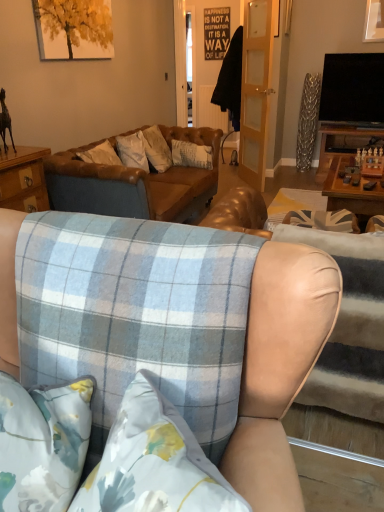
The width and height of the screenshot is (384, 512). What do you see at coordinates (335, 430) in the screenshot?
I see `blue plaid fabric at center, placed as the second studio couch when sorted from back to front` at bounding box center [335, 430].

Locate an element on the screen. This screenshot has height=512, width=384. blue plaid fabric at center, arranged as the 2th studio couch when viewed from the front is located at coordinates (335, 430).

In the scene shown: In the image, is blue plaid fabric at center, placed as the 1th studio couch when sorted from front to back, on the left side or the right side of blue plaid fabric at center, placed as the second studio couch when sorted from back to front?

Clearly, blue plaid fabric at center, placed as the 1th studio couch when sorted from front to back, is on the left of blue plaid fabric at center, placed as the second studio couch when sorted from back to front, in the image.

Between point (255, 470) and point (284, 418), which one is positioned in front?

Point (255, 470)

Does blue plaid fabric at center, positioned as the third studio couch in back-to-front order, have a greater height compared to blue plaid fabric at center, placed as the second studio couch when sorted from back to front?

Indeed, blue plaid fabric at center, positioned as the third studio couch in back-to-front order, has a greater height compared to blue plaid fabric at center, placed as the second studio couch when sorted from back to front.

Does blue plaid fabric at center, positioned as the third studio couch in back-to-front order, have a greater width compared to blue plaid fabric at center, arranged as the 2th studio couch when viewed from the front?

In fact, blue plaid fabric at center, positioned as the third studio couch in back-to-front order, might be narrower than blue plaid fabric at center, arranged as the 2th studio couch when viewed from the front.

In terms of height, does blue plaid fabric couch at center, which appears as the third studio couch when viewed from the front, look taller or shorter compared to blue plaid fabric at center, placed as the 1th studio couch when sorted from front to back?

Clearly, blue plaid fabric couch at center, which appears as the third studio couch when viewed from the front, is shorter compared to blue plaid fabric at center, placed as the 1th studio couch when sorted from front to back.

From a real-world perspective, which object rests below the other?

In real-world perspective, blue plaid fabric couch at center, positioned as the 1th studio couch in back-to-front order, is lower.

Which object is further away from the camera taking this photo, blue plaid fabric couch at center, positioned as the 1th studio couch in back-to-front order, or blue plaid fabric at center, positioned as the third studio couch in back-to-front order?

blue plaid fabric couch at center, positioned as the 1th studio couch in back-to-front order, is more distant.

Which of these two, blue plaid fabric couch at center, which appears as the third studio couch when viewed from the front, or blue plaid fabric at center, positioned as the third studio couch in back-to-front order, is bigger?

blue plaid fabric couch at center, which appears as the third studio couch when viewed from the front, is bigger.

Considering the sizes of blue plaid fabric at center, arranged as the 2th studio couch when viewed from the front, and blue plaid fabric couch at center, positioned as the 1th studio couch in back-to-front order, in the image, is blue plaid fabric at center, arranged as the 2th studio couch when viewed from the front, taller or shorter than blue plaid fabric couch at center, positioned as the 1th studio couch in back-to-front order,?

blue plaid fabric at center, arranged as the 2th studio couch when viewed from the front, is taller than blue plaid fabric couch at center, positioned as the 1th studio couch in back-to-front order.

Which of these two, blue plaid fabric at center, arranged as the 2th studio couch when viewed from the front, or blue plaid fabric couch at center, which appears as the third studio couch when viewed from the front, is thinner?

Thinner between the two is blue plaid fabric at center, arranged as the 2th studio couch when viewed from the front.

Between point (254, 205) and point (121, 211), which one is positioned in front?

The point (254, 205) is closer to the camera.

Can you see blue plaid fabric at center, arranged as the 2th studio couch when viewed from the front, touching blue plaid fabric couch at center, positioned as the 1th studio couch in back-to-front order?

blue plaid fabric at center, arranged as the 2th studio couch when viewed from the front, and blue plaid fabric couch at center, positioned as the 1th studio couch in back-to-front order, are clearly separated.

Which of these two, blue plaid fabric at center, placed as the second studio couch when sorted from back to front, or blue plaid fabric at center, positioned as the third studio couch in back-to-front order, is bigger?

Bigger between the two is blue plaid fabric at center, positioned as the third studio couch in back-to-front order.

Is blue plaid fabric at center, placed as the second studio couch when sorted from back to front, looking in the opposite direction of blue plaid fabric at center, placed as the 1th studio couch when sorted from front to back?

Yes.

Can blue plaid fabric at center, placed as the 1th studio couch when sorted from front to back, be found inside blue plaid fabric at center, arranged as the 2th studio couch when viewed from the front?

No, blue plaid fabric at center, arranged as the 2th studio couch when viewed from the front, does not contain blue plaid fabric at center, placed as the 1th studio couch when sorted from front to back.

Which studio couch is the 1st one when counting from the left side of the blue plaid fabric at center, arranged as the 2th studio couch when viewed from the front? Please provide its 2D coordinates.

[(279, 367)]

Is blue plaid fabric at center, arranged as the 2th studio couch when viewed from the front, completely or partially inside blue plaid fabric couch at center, which appears as the third studio couch when viewed from the front?

Actually, blue plaid fabric at center, arranged as the 2th studio couch when viewed from the front, is outside blue plaid fabric couch at center, which appears as the third studio couch when viewed from the front.

From the image's perspective, which is above, blue plaid fabric couch at center, which appears as the third studio couch when viewed from the front, or blue plaid fabric at center, placed as the second studio couch when sorted from back to front?

blue plaid fabric couch at center, which appears as the third studio couch when viewed from the front, is shown above in the image.

Is point (183, 178) in front of point (220, 198)?

No, it is behind (220, 198).

Consider the image. What's the angular difference between blue plaid fabric couch at center, positioned as the 1th studio couch in back-to-front order, and blue plaid fabric at center, placed as the second studio couch when sorted from back to front,'s facing directions?

The angle between the facing direction of blue plaid fabric couch at center, positioned as the 1th studio couch in back-to-front order, and the facing direction of blue plaid fabric at center, placed as the second studio couch when sorted from back to front, is 92.5 degrees.

Which object is positioned more to the right, blue plaid fabric at center, positioned as the third studio couch in back-to-front order, or blue plaid fabric couch at center, which appears as the third studio couch when viewed from the front?

blue plaid fabric at center, positioned as the third studio couch in back-to-front order.

From the image's perspective, which studio couch is the 2nd one below the blue plaid fabric couch at center, positioned as the 1th studio couch in back-to-front order? Please provide its 2D coordinates.

[(279, 367)]

Based on the photo, from a real-world perspective, relative to blue plaid fabric couch at center, positioned as the 1th studio couch in back-to-front order, is blue plaid fabric at center, positioned as the third studio couch in back-to-front order, vertically above or below?

In terms of real-world spatial position, blue plaid fabric at center, positioned as the third studio couch in back-to-front order, is above blue plaid fabric couch at center, positioned as the 1th studio couch in back-to-front order.

Can blue plaid fabric couch at center, which appears as the third studio couch when viewed from the front, be found inside blue plaid fabric at center, placed as the 1th studio couch when sorted from front to back?

No, blue plaid fabric at center, placed as the 1th studio couch when sorted from front to back, does not contain blue plaid fabric couch at center, which appears as the third studio couch when viewed from the front.

At what (x,y) coordinates should I click in order to perform the action: click on the 1st studio couch counting from the left side of the blue plaid fabric at center, placed as the second studio couch when sorted from back to front. Please return your answer as a coordinate pair (x, y). Looking at the image, I should click on (279, 367).

Locate an element on the screen. the 2nd studio couch behind the blue plaid fabric at center, placed as the 1th studio couch when sorted from front to back, starting your count from the anchor is located at coordinates (134, 183).

Based on their spatial positions, is blue plaid fabric couch at center, which appears as the third studio couch when viewed from the front, or blue plaid fabric at center, placed as the second studio couch when sorted from back to front, closer to blue plaid fabric at center, placed as the 1th studio couch when sorted from front to back?

blue plaid fabric at center, placed as the second studio couch when sorted from back to front, lies closer to blue plaid fabric at center, placed as the 1th studio couch when sorted from front to back, than the other object.

Considering their positions, is blue plaid fabric couch at center, which appears as the third studio couch when viewed from the front, positioned further to blue plaid fabric at center, arranged as the 2th studio couch when viewed from the front, than blue plaid fabric at center, placed as the 1th studio couch when sorted from front to back?

The object further to blue plaid fabric at center, arranged as the 2th studio couch when viewed from the front, is blue plaid fabric couch at center, which appears as the third studio couch when viewed from the front.

Based on their spatial positions, is blue plaid fabric at center, placed as the second studio couch when sorted from back to front, or blue plaid fabric at center, positioned as the third studio couch in back-to-front order, closer to blue plaid fabric couch at center, positioned as the 1th studio couch in back-to-front order?

blue plaid fabric at center, placed as the second studio couch when sorted from back to front.

When comparing their distances from blue plaid fabric at center, placed as the second studio couch when sorted from back to front, does blue plaid fabric at center, positioned as the third studio couch in back-to-front order, or blue plaid fabric couch at center, which appears as the third studio couch when viewed from the front, seem closer?

Among the two, blue plaid fabric at center, positioned as the third studio couch in back-to-front order, is located nearer to blue plaid fabric at center, placed as the second studio couch when sorted from back to front.

When comparing their distances from blue plaid fabric couch at center, which appears as the third studio couch when viewed from the front, does blue plaid fabric at center, positioned as the third studio couch in back-to-front order, or blue plaid fabric at center, placed as the second studio couch when sorted from back to front, seem further?

Among the two, blue plaid fabric at center, positioned as the third studio couch in back-to-front order, is located further to blue plaid fabric couch at center, which appears as the third studio couch when viewed from the front.

From the picture: Looking at the image, which one is located closer to blue plaid fabric at center, placed as the 1th studio couch when sorted from front to back, blue plaid fabric at center, arranged as the 2th studio couch when viewed from the front, or blue plaid fabric couch at center, positioned as the 1th studio couch in back-to-front order?

blue plaid fabric at center, arranged as the 2th studio couch when viewed from the front.

Locate an element on the screen. This screenshot has width=384, height=512. studio couch positioned between blue plaid fabric at center, positioned as the third studio couch in back-to-front order, and blue plaid fabric couch at center, which appears as the third studio couch when viewed from the front, from near to far is located at coordinates (335, 430).